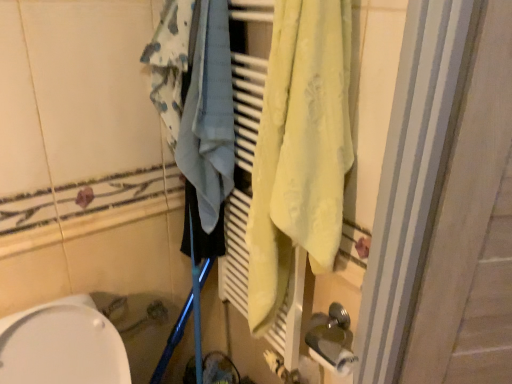
Image resolution: width=512 pixels, height=384 pixels. I want to click on white glossy toilet at lower left, so click(x=62, y=345).

This screenshot has height=384, width=512. What do you see at coordinates (62, 345) in the screenshot?
I see `white glossy toilet at lower left` at bounding box center [62, 345].

What do you see at coordinates (209, 115) in the screenshot? The height and width of the screenshot is (384, 512). I see `light blue fabric at center` at bounding box center [209, 115].

In order to click on white striped screen door at right in this screenshot , I will do `click(472, 229)`.

Locate an element on the screen. The height and width of the screenshot is (384, 512). white glossy toilet at lower left is located at coordinates (62, 345).

Locate an element on the screen. This screenshot has width=512, height=384. screen door above the white glossy toilet at lower left (from a real-world perspective) is located at coordinates (472, 229).

Is white striped screen door at right at the back of white glossy toilet at lower left?

No, white glossy toilet at lower left is not facing away from white striped screen door at right.

From the image's perspective, which one is positioned lower, white glossy toilet at lower left or white striped screen door at right?

white glossy toilet at lower left.

From a real-world perspective, is white glossy toilet at lower left positioned above or below white striped screen door at right?

Clearly, from a real-world perspective, white glossy toilet at lower left is below white striped screen door at right.

Which object is more forward, white glossy toilet at lower left or light blue fabric at center?

white glossy toilet at lower left is closer to the camera.

Is white glossy toilet at lower left facing away from light blue fabric at center?

white glossy toilet at lower left does not have its back to light blue fabric at center.

Can you see white glossy toilet at lower left touching light blue fabric at center?

There is a gap between white glossy toilet at lower left and light blue fabric at center.

Is white glossy toilet at lower left inside or outside of light blue fabric at center?

white glossy toilet at lower left cannot be found inside light blue fabric at center.

From the picture: In terms of height, does light blue fabric at center look taller or shorter compared to white matte toilet paper at lower right?

Considering their sizes, light blue fabric at center has more height than white matte toilet paper at lower right.

How much distance is there between light blue fabric at center and white matte toilet paper at lower right?

The distance of light blue fabric at center from white matte toilet paper at lower right is 26.60 inches.

Based on their sizes in the image, would you say light blue fabric at center is bigger or smaller than white matte toilet paper at lower right?

In the image, light blue fabric at center appears to be larger than white matte toilet paper at lower right.

Does light blue fabric at center appear on the left side of white matte toilet paper at lower right?

Yes, light blue fabric at center is to the left of white matte toilet paper at lower right.

Relative to white glossy toilet at lower left, is light blue fabric at center in front or behind?

Visually, light blue fabric at center is located behind white glossy toilet at lower left.

Is light blue fabric at center bigger than white glossy toilet at lower left?

Incorrect, light blue fabric at center is not larger than white glossy toilet at lower left.

Is light blue fabric at center next to white glossy toilet at lower left?

No, light blue fabric at center is not in contact with white glossy toilet at lower left.

How far apart are light blue fabric at center and white glossy toilet at lower left?

They are 21.02 inches apart.

From the picture: Choose the correct answer: Is white matte toilet paper at lower right inside white glossy toilet at lower left or outside it?

white matte toilet paper at lower right is spatially situated outside white glossy toilet at lower left.

Is white matte toilet paper at lower right next to white glossy toilet at lower left?

They are not placed beside each other.

The width and height of the screenshot is (512, 384). I want to click on toilet that is on the left side of white matte toilet paper at lower right, so click(x=62, y=345).

Is white matte toilet paper at lower right oriented away from white glossy toilet at lower left?

No, white glossy toilet at lower left is not at the back of white matte toilet paper at lower right.

Does white striped screen door at right have a greater width compared to white glossy toilet at lower left?

No.

Considering the positions of objects white striped screen door at right and white glossy toilet at lower left in the image provided, who is more to the right, white striped screen door at right or white glossy toilet at lower left?

Positioned to the right is white striped screen door at right.

Is white glossy toilet at lower left at the back of white striped screen door at right?

No, white glossy toilet at lower left is not at the back of white striped screen door at right.

Which is in front, point (483, 49) or point (78, 321)?

The point (483, 49) is closer to the camera.

Between white striped screen door at right and light blue fabric at center, which one has smaller size?

light blue fabric at center is smaller.

Is white striped screen door at right not within light blue fabric at center?

Yes, white striped screen door at right is located beyond the bounds of light blue fabric at center.

From a real-world perspective, between white striped screen door at right and light blue fabric at center, who is vertically lower?

white striped screen door at right.

Is white striped screen door at right to the left of light blue fabric at center from the viewer's perspective?

No, white striped screen door at right is not to the left of light blue fabric at center.

This screenshot has width=512, height=384. I want to click on screen door behind the white glossy toilet at lower left, so click(472, 229).

Locate an element on the screen. bath towel that appears above the white glossy toilet at lower left (from a real-world perspective) is located at coordinates (209, 115).

Looking at the image, which one is located further to white striped screen door at right, light blue fabric at center or white glossy toilet at lower left?

white glossy toilet at lower left.

Consider the image. Considering their positions, is white matte toilet paper at lower right positioned further to white striped screen door at right than light blue fabric at center?

light blue fabric at center is positioned further to the anchor white striped screen door at right.

Looking at the image, which one is located closer to white striped screen door at right, white matte toilet paper at lower right or white glossy toilet at lower left?

white matte toilet paper at lower right is positioned closer to the anchor white striped screen door at right.

From the image, which object appears to be farther from white glossy toilet at lower left, white matte toilet paper at lower right or white striped screen door at right?

Based on the image, white striped screen door at right appears to be further to white glossy toilet at lower left.

Which object lies nearer to the anchor point light blue fabric at center, white matte toilet paper at lower right or white striped screen door at right?

Based on the image, white striped screen door at right appears to be nearer to light blue fabric at center.

From the image, which object appears to be farther from light blue fabric at center, white striped screen door at right or white glossy toilet at lower left?

Among the two, white striped screen door at right is located further to light blue fabric at center.

Looking at the image, which one is located closer to white matte toilet paper at lower right, white glossy toilet at lower left or light blue fabric at center?

light blue fabric at center is positioned closer to the anchor white matte toilet paper at lower right.

Which object lies nearer to the anchor point light blue fabric at center, white matte toilet paper at lower right or white glossy toilet at lower left?

white glossy toilet at lower left.

The image size is (512, 384). What are the coordinates of `bath towel situated between white glossy toilet at lower left and white striped screen door at right from left to right` in the screenshot? It's located at (209, 115).

You are a GUI agent. You are given a task and a screenshot of the screen. Output one action in this format:
    pyautogui.click(x=<x>, y=<y>)
    Task: Click on the toilet paper between light blue fabric at center and white glossy toilet at lower left vertically
    
    Given the screenshot: What is the action you would take?
    pyautogui.click(x=336, y=361)

Locate an element on the screen. toilet paper between white glossy toilet at lower left and white striped screen door at right is located at coordinates (336, 361).

Identify the location of toilet paper between light blue fabric at center and white striped screen door at right from left to right. Image resolution: width=512 pixels, height=384 pixels. (336, 361).